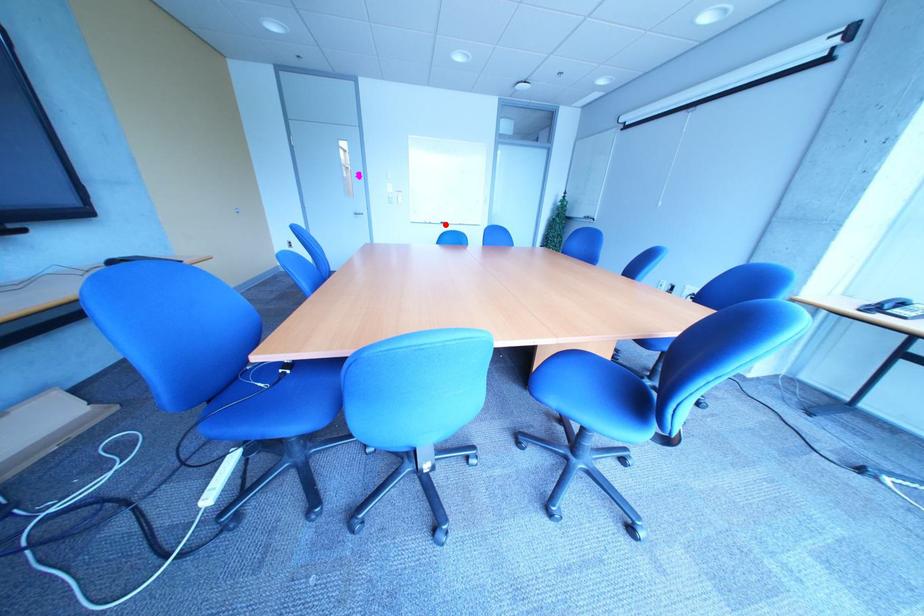
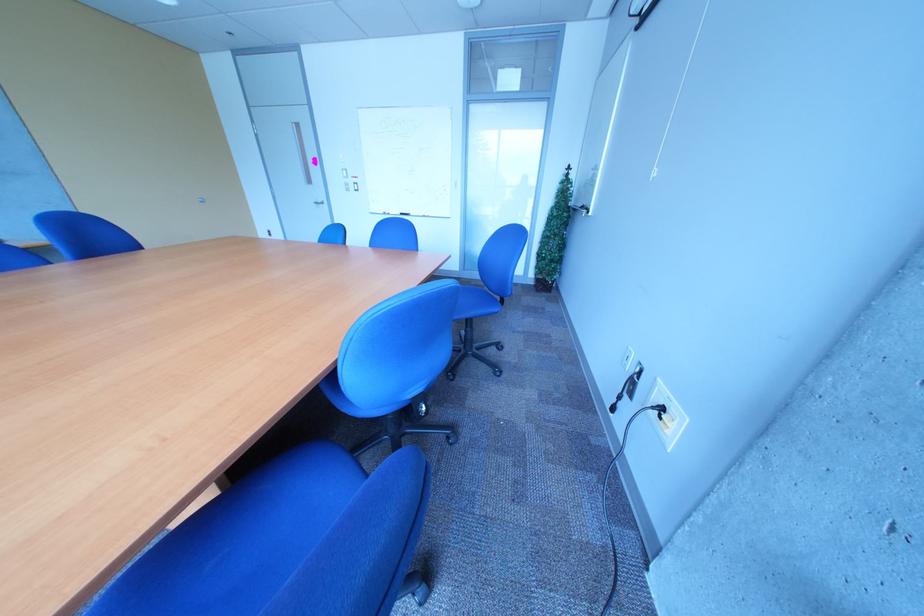
In the second image, find the point that corresponds to the highlighted location in the first image.

(405, 216)